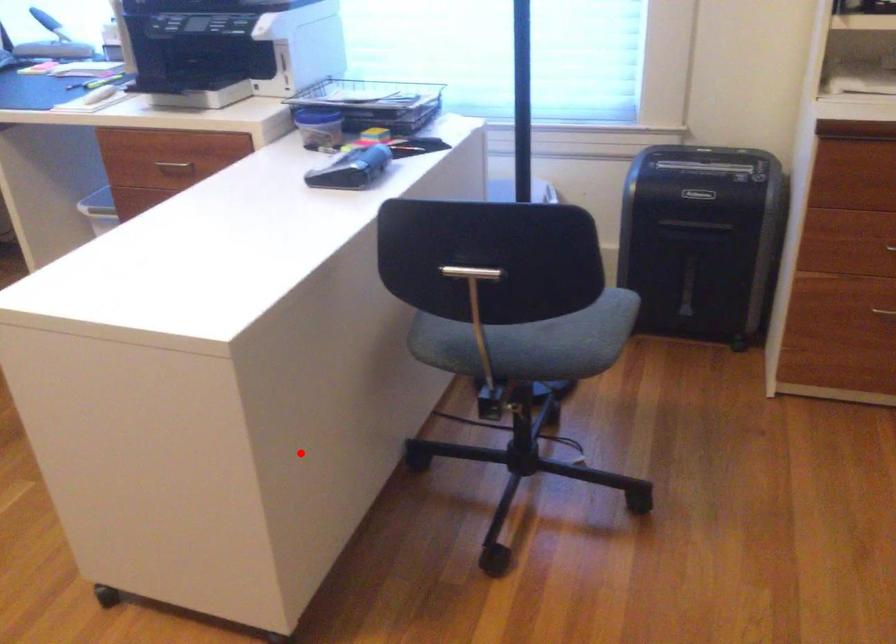
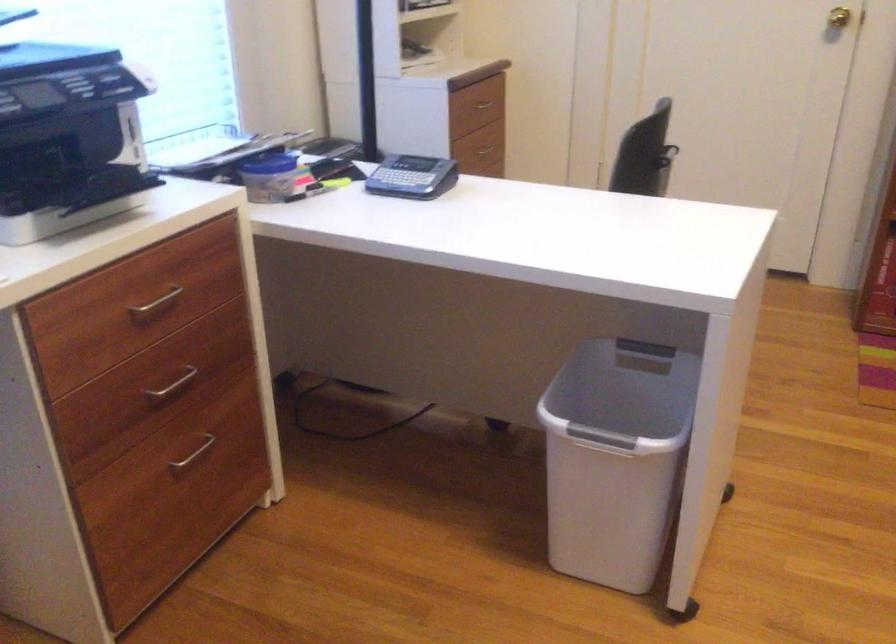
Question: I am providing you with two images of the same scene from different viewpoints. A red point is shown in image1. For the corresponding object point in image2, is it positioned nearer or farther from the camera?

Choices:
 (A) Nearer
 (B) Farther

Answer: (B)